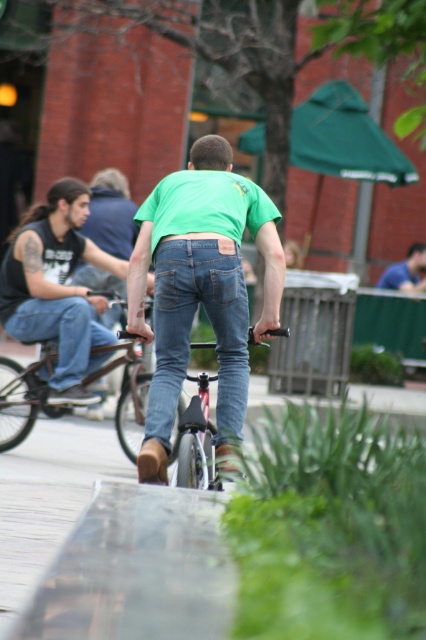
You are a delivery person who needs to reach the shiny black bicycle at center. You are currently standing next to the denim jeans at center. Is the distance between you and the bicycle sufficient to allow you to ride the bicycle without needing to move closer?

The denim jeans at center and shiny black bicycle at center are 3.83 meters apart. Since 3.83 meters is a reasonable distance for a person to reach the bicycle without needing to move closer, you can ride the shiny black bicycle at center from your current position.